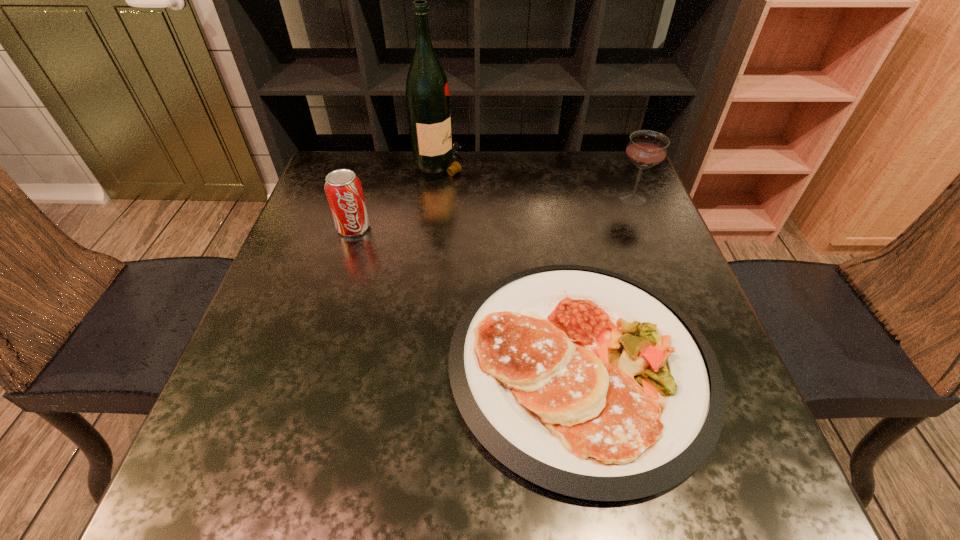
The width and height of the screenshot is (960, 540). What are the coordinates of `vacant point located between the wine bottle and the nearest object` in the screenshot? It's located at (511, 264).

Find the location of `vacant space that is in between the tallest object and the soda can`. vacant space that is in between the tallest object and the soda can is located at coordinates (397, 195).

The width and height of the screenshot is (960, 540). I want to click on free area in between the third farthest object and the farthest object, so click(x=397, y=195).

Find the location of a particular element. free space that is in between the soda can and the wine bottle is located at coordinates (397, 195).

Locate an element on the screen. This screenshot has width=960, height=540. free spot between the wine bottle and the third tallest object is located at coordinates (397, 195).

Identify which object is the nearest to the wineglass. Please provide its 2D coordinates. Your answer should be formatted as a tuple, i.e. [(x, y)], where the tuple contains the x and y coordinates of a point satisfying the conditions above.

[(588, 383)]

You are a GUI agent. You are given a task and a screenshot of the screen. Output one action in this format:
    pyautogui.click(x=<x>, y=<y>)
    Task: Click on the object that stands as the second closest to the second nearest object
    The image size is (960, 540).
    Given the screenshot: What is the action you would take?
    pyautogui.click(x=588, y=383)

Identify the location of free space that satisfies the following two spatial constraints: 1. on the back side of the wine bottle; 2. on the right side of the second nearest object. Image resolution: width=960 pixels, height=540 pixels. (373, 164).

Locate an element on the screen. This screenshot has height=540, width=960. free location that satisfies the following two spatial constraints: 1. on the front side of the soda can; 2. on the left side of the dish is located at coordinates (311, 364).